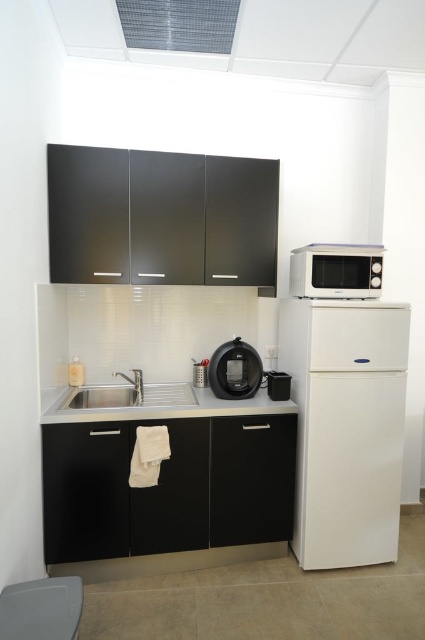
Question: Where is white glossy microwave at upper right located in relation to satin black coffee maker at center in the image?

Choices:
 (A) right
 (B) left

Answer: (A)

Question: Does satin black counter top at center have a larger size compared to white glossy microwave at upper right?

Choices:
 (A) yes
 (B) no

Answer: (A)

Question: Estimate the real-world distances between objects in this image. Which object is closer to the white matte refrigerator at right?

Choices:
 (A) black plastic toaster at lower center
 (B) satin black counter top at center

Answer: (A)

Question: Which is farther from the stainless steel sink at lower center?

Choices:
 (A) satin black counter top at center
 (B) black plastic toaster at lower center

Answer: (B)

Question: Is white matte exhaust hood at upper center below satin black coffee maker at center?

Choices:
 (A) yes
 (B) no

Answer: (B)

Question: Which point is farther from the camera taking this photo?

Choices:
 (A) (59, 396)
 (B) (354, 538)

Answer: (A)